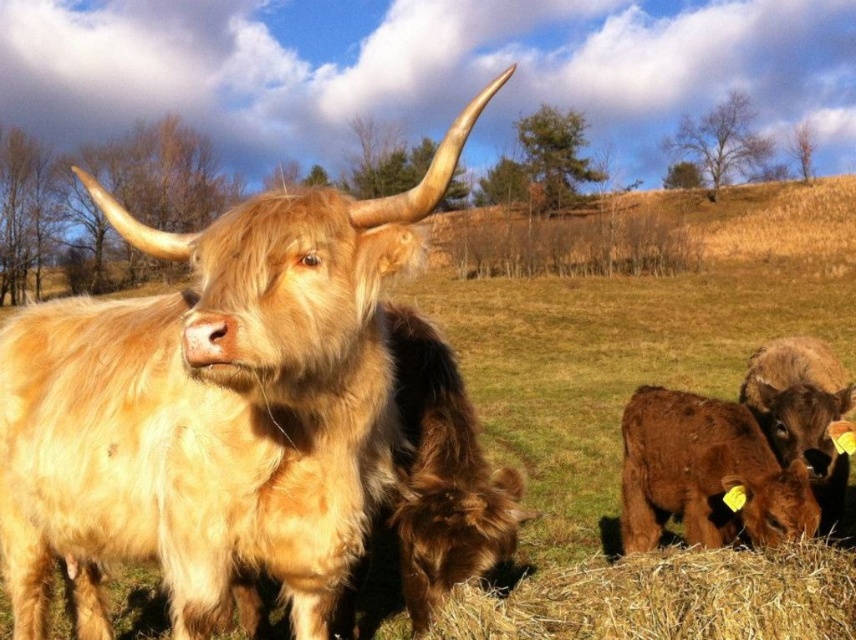
Question: Can you confirm if golden straw bale at lower right is positioned below brown fuzzy calf at lower right?

Choices:
 (A) no
 (B) yes

Answer: (A)

Question: Is golden woolen bull at center above golden straw bale at lower right?

Choices:
 (A) yes
 (B) no

Answer: (A)

Question: Which of these objects is positioned farthest from the brown fuzzy calf at lower right?

Choices:
 (A) golden straw bale at lower right
 (B) golden woolen bull at center

Answer: (B)

Question: Among these objects, which one is nearest to the camera?

Choices:
 (A) golden woolen bull at center
 (B) brown fuzzy calf at lower right
 (C) golden straw bale at lower right

Answer: (C)

Question: Which point is closer to the camera?

Choices:
 (A) (794, 476)
 (B) (597, 566)

Answer: (B)

Question: Can you confirm if golden woolen bull at center is positioned above brown fuzzy calf at lower right?

Choices:
 (A) no
 (B) yes

Answer: (B)